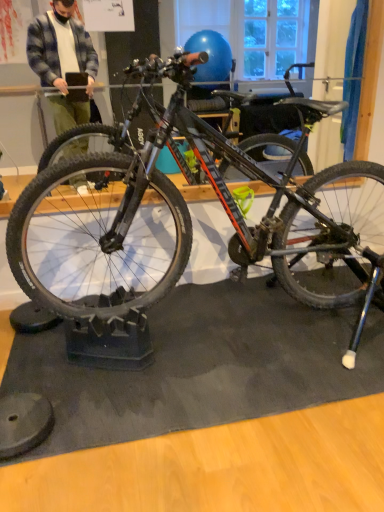
Find the location of `vacant region under shiny metallic bicycle at center (from a real-world perspective)`. vacant region under shiny metallic bicycle at center (from a real-world perspective) is located at coordinates (215, 332).